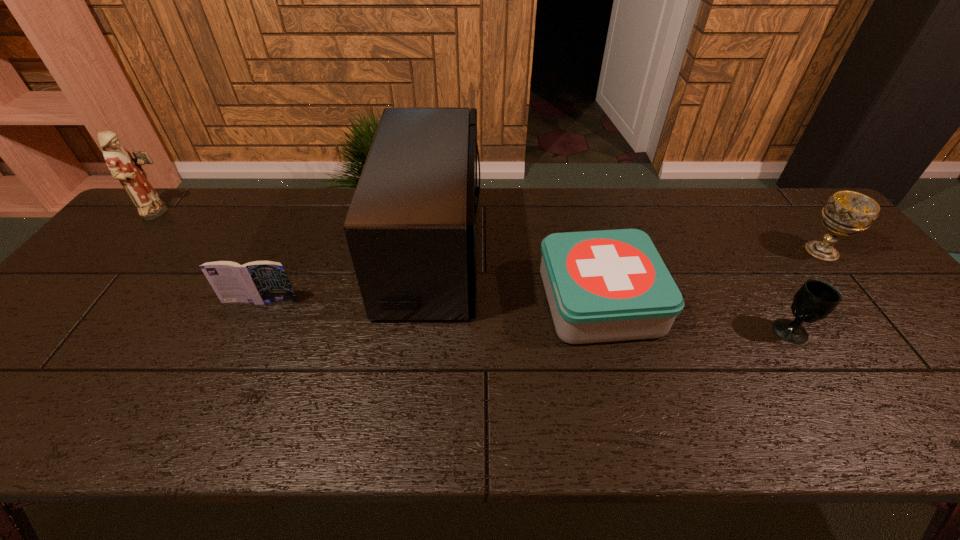
This screenshot has width=960, height=540. What are the coordinates of `vacant space that satisfies the following two spatial constraints: 1. on the front-facing side of the fourth object from right to left; 2. on the front cover of the book` in the screenshot? It's located at (426, 301).

Find the location of a particular element. The height and width of the screenshot is (540, 960). blank area in the image that satisfies the following two spatial constraints: 1. on the front-facing side of the farther chalice; 2. on the left side of the leftmost object is located at coordinates (128, 252).

Identify the location of vacant region that satisfies the following two spatial constraints: 1. on the front-facing side of the figurine; 2. on the right side of the rightmost object. This screenshot has width=960, height=540. (128, 252).

Locate an element on the screen. The width and height of the screenshot is (960, 540). free location that satisfies the following two spatial constraints: 1. on the front-facing side of the third object from left to right; 2. on the right side of the third tallest object is located at coordinates (432, 252).

Where is `free spot that satisfies the following two spatial constraints: 1. on the front-facing side of the first-aid kit; 2. on the left side of the third object from left to right`? free spot that satisfies the following two spatial constraints: 1. on the front-facing side of the first-aid kit; 2. on the left side of the third object from left to right is located at coordinates (426, 301).